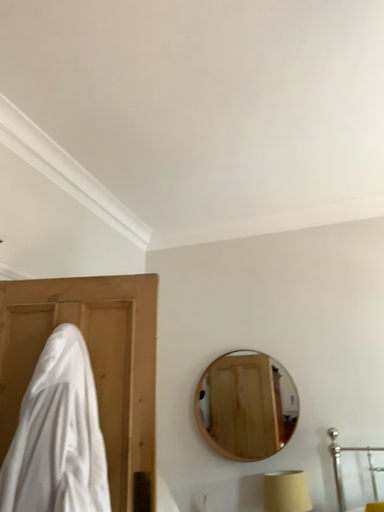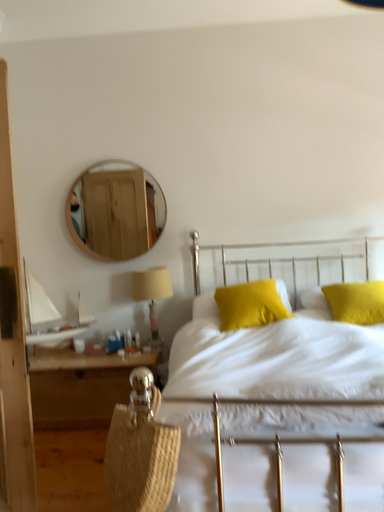
Question: Which way did the camera rotate in the video?

Choices:
 (A) rotated right
 (B) rotated left

Answer: (A)